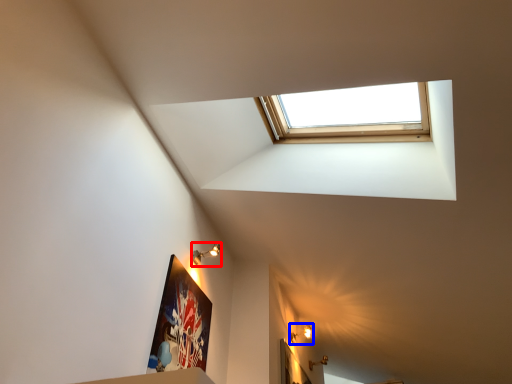
Question: Which object is further to the camera taking this photo, light fixture (highlighted by a red box) or light fixture (highlighted by a blue box)?

Choices:
 (A) light fixture
 (B) light fixture

Answer: (B)